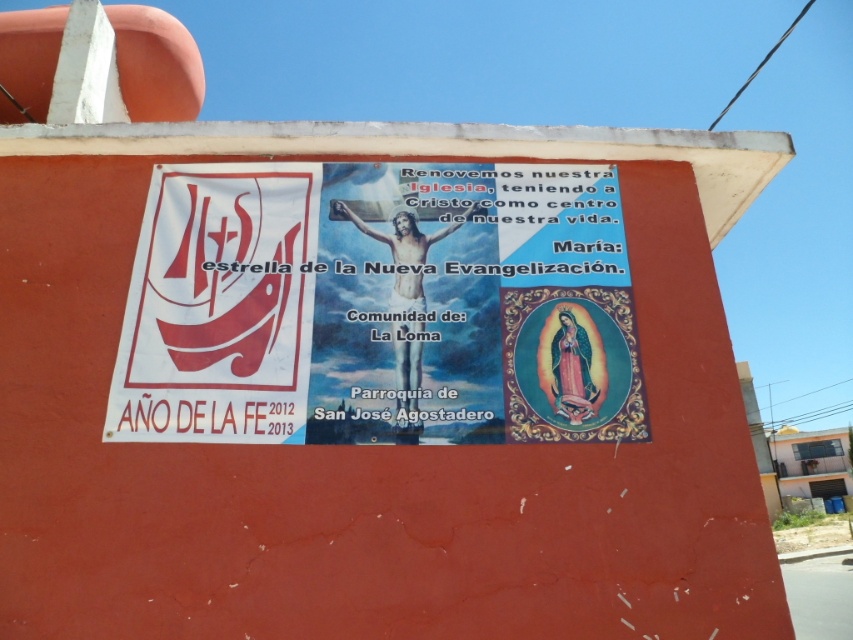
Does white paper poster at upper center have a smaller size compared to white paper poster at center?

No.

Is white paper poster at upper center wider than white paper poster at center?

Yes, white paper poster at upper center is wider than white paper poster at center.

The width and height of the screenshot is (853, 640). In order to click on white paper poster at upper center in this screenshot , I will do click(x=374, y=381).